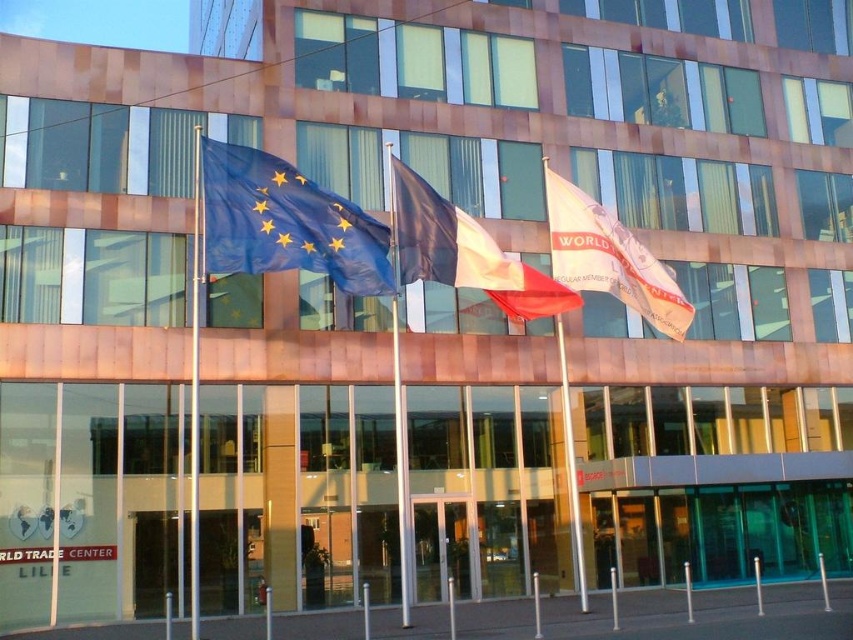
Question: Can you confirm if blue fabric flag at center is positioned above silver metallic flag pole at center?

Choices:
 (A) no
 (B) yes

Answer: (B)

Question: Which point is closer to the camera?

Choices:
 (A) (525, 276)
 (B) (281, 205)
 (C) (611, 280)

Answer: (B)

Question: Is metallic flag pole at center positioned in front of silver metallic flag pole at center?

Choices:
 (A) yes
 (B) no

Answer: (A)

Question: Does blue fabric flag at center have a lesser width compared to silver metallic flag pole at center?

Choices:
 (A) no
 (B) yes

Answer: (A)

Question: Which point is closer to the camera taking this photo?

Choices:
 (A) (263, 209)
 (B) (405, 520)

Answer: (A)

Question: Which object is farther from the camera taking this photo?

Choices:
 (A) blue fabric flag at center
 (B) white cotton flag at center

Answer: (B)